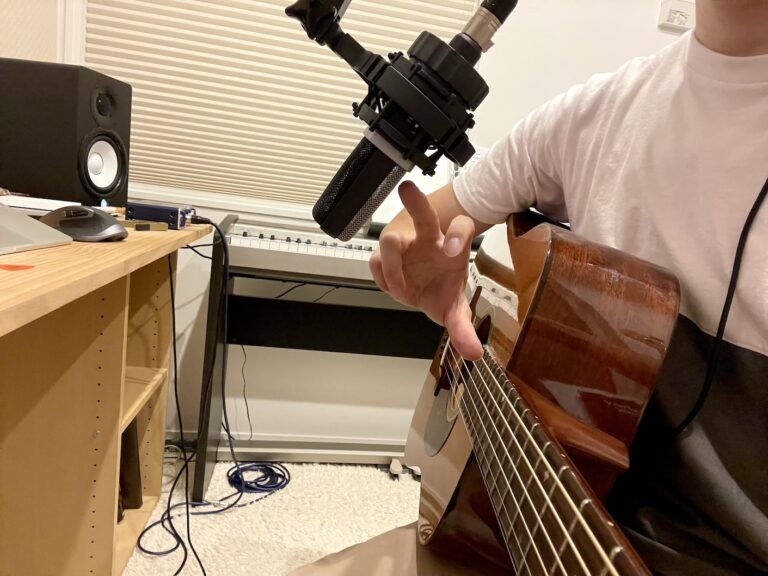
At what (x,y) coordinates should I click in order to perform the action: click on wall behind guitarist. Please return your answer as a coordinate pair (x, y). Image resolution: width=768 pixels, height=576 pixels. Looking at the image, I should click on (611, 36).